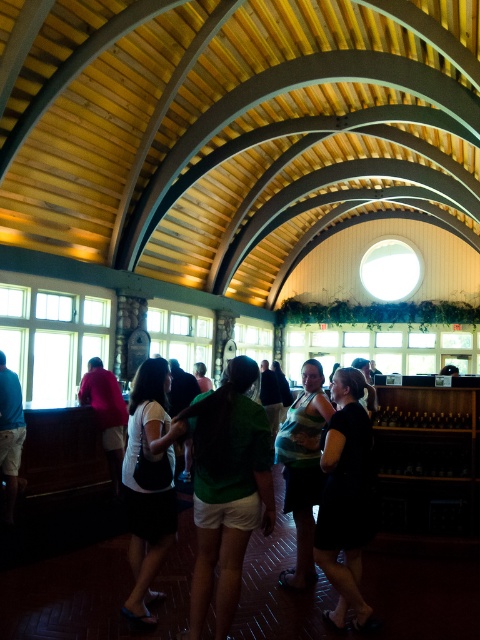
Between point (142, 417) and point (117, 476), which one is positioned in front?

Point (142, 417)

Is the position of white matte shirt at center more distant than that of matte pink shirt at center?

No, white matte shirt at center is in front of matte pink shirt at center.

Does point (146, 624) lie in front of point (113, 465)?

Yes, point (146, 624) is closer to viewer.

I want to click on white matte shirt at center, so [146, 488].

Is white matte shirt at center positioned in front of blue shirt at left?

That is True.

Consider the image. Does white matte shirt at center have a larger size compared to blue shirt at left?

Indeed, white matte shirt at center has a larger size compared to blue shirt at left.

Which is behind, point (131, 413) or point (12, 436)?

Point (12, 436)

I want to click on white matte shirt at center, so click(146, 488).

Which is in front, point (197, 470) or point (116, 433)?

Positioned in front is point (197, 470).

Does point (227, 477) come farther from viewer compared to point (103, 432)?

That is False.

The width and height of the screenshot is (480, 640). I want to click on green fabric shirt at center, so click(x=227, y=486).